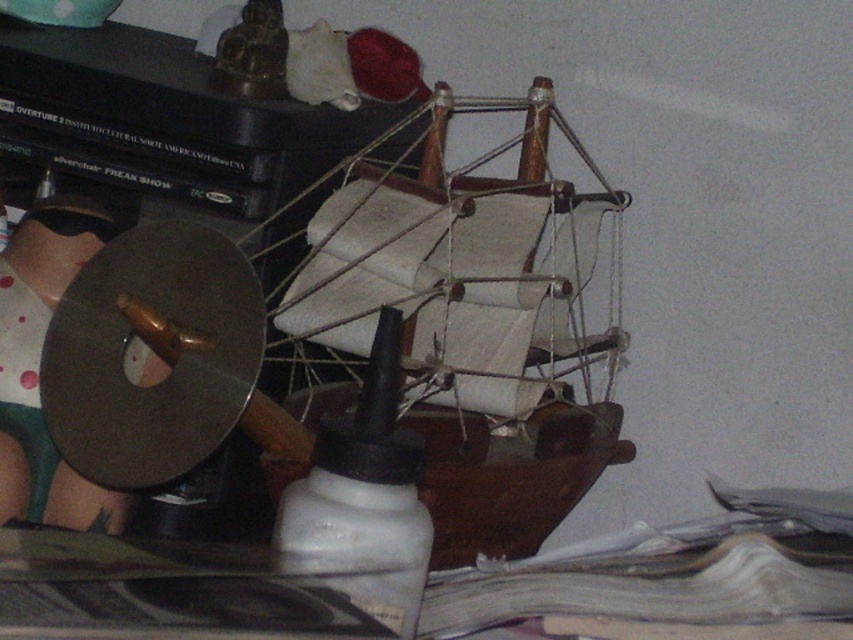
From the picture: You are organizing items on a table and need to place the white matte bottle at center and the matte black disc at left. If you want to arrange them so that the one taking up more space is on the right side of the table, which object should you place on the right?

The matte black disc at left takes up more space than the white matte bottle at center, so you should place the matte black disc at left on the right side of the table.

You are organizing items on a table and need to place a new object between the white matte bottle at center and the matte black disc at left. What is the minimum width this new object should have to fit between them without overlapping?

The minimum width should be just under 9.85 inches to fit between the white matte bottle at center and the matte black disc at left without overlapping.

You are standing at the point marked as point (x=364, y=496) on the table. Looking towards the wooden ship with white sails in the foreground, which direction should you turn to face the spinning wheel or similar device to the left of the ship?

The white matte bottle at center is located at point (x=364, y=496). Since the spinning wheel is to the left of the ship, which is in front of you, you should turn to your left to face the spinning wheel.